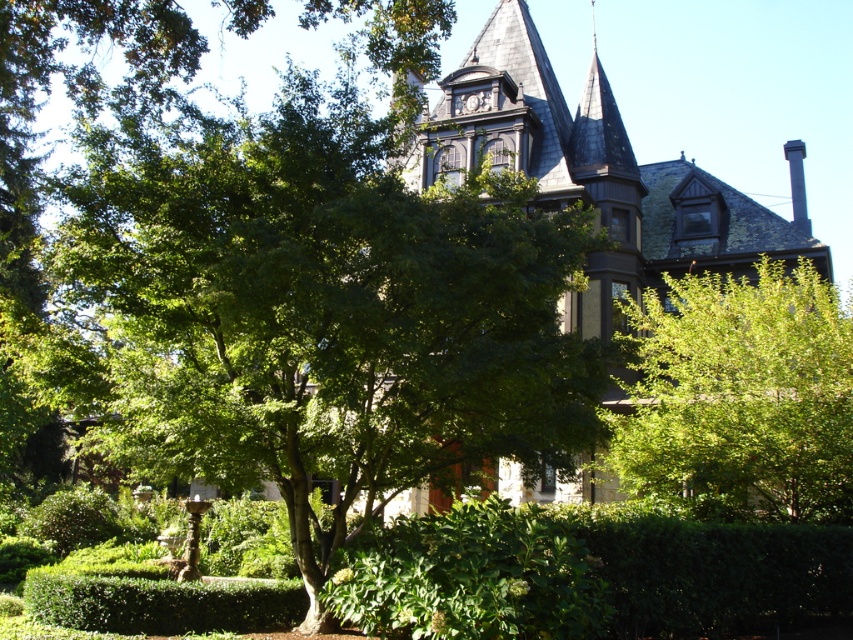
You are a landscape architect designing a garden path that needs to pass between the green leafy tree at center and the green leafy bush at right. Considering their sizes, which one should you place the path closer to?

The path should be placed closer to the green leafy bush at right because the green leafy tree at center is larger in size than the green leafy bush at right, so the tree requires more space around it.

Based on the photo, you are standing in front of the grand building and want to walk from the fountain to the green leafy bush at right. Which direction should you head relative to the green leafy tree at center?

You should head to the right of the green leafy tree at center because the green leafy bush at right is located to its right side.

You are a visitor standing at point (x=323, y=310) in the image. What do you see directly in front of you?

You see a green leafy tree at center directly in front of you at point (x=323, y=310).